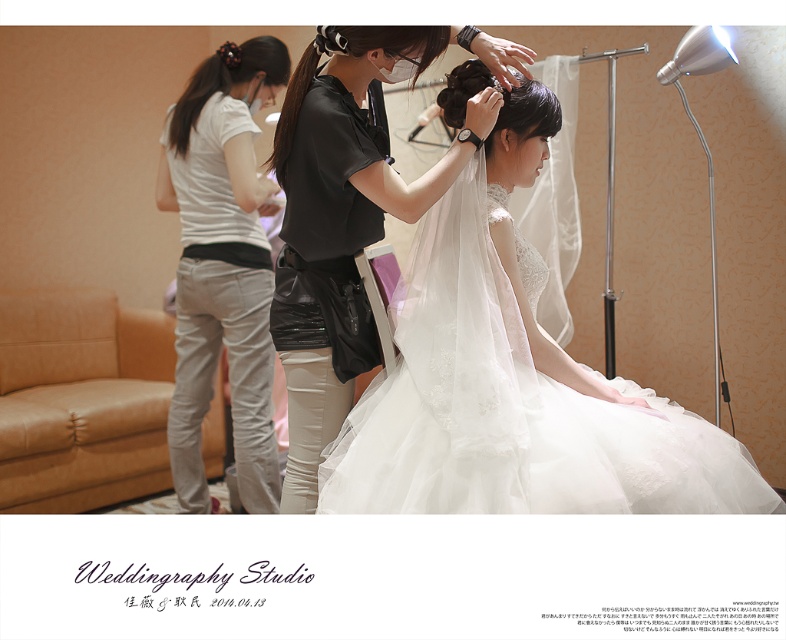
Between matte black shirt at center and white lace veil at upper center, which one appears on the left side from the viewer's perspective?

matte black shirt at center is more to the left.

Is point (296, 392) positioned after point (533, 96)?

Yes, it is behind point (533, 96).

Find the location of a particular element. matte black shirt at center is located at coordinates (346, 202).

Can you confirm if black shiny hair at upper left is positioned below black glossy hair at center?

No, black shiny hair at upper left is not below black glossy hair at center.

Between black shiny hair at upper left and black glossy hair at center, which one appears on the left side from the viewer's perspective?

black shiny hair at upper left

Which is behind, point (189, 99) or point (375, 36)?

Point (189, 99)

The width and height of the screenshot is (786, 640). I want to click on black shiny hair at upper left, so click(x=226, y=81).

Is the position of black shiny hair at upper left more distant than that of white lace veil at upper center?

Yes, black shiny hair at upper left is behind white lace veil at upper center.

Is black shiny hair at upper left to the left of white lace veil at upper center from the viewer's perspective?

Yes, black shiny hair at upper left is to the left of white lace veil at upper center.

You are a GUI agent. You are given a task and a screenshot of the screen. Output one action in this format:
    pyautogui.click(x=<x>, y=<y>)
    Task: Click on the black shiny hair at upper left
    Image resolution: width=786 pixels, height=640 pixels.
    Given the screenshot: What is the action you would take?
    pyautogui.click(x=226, y=81)